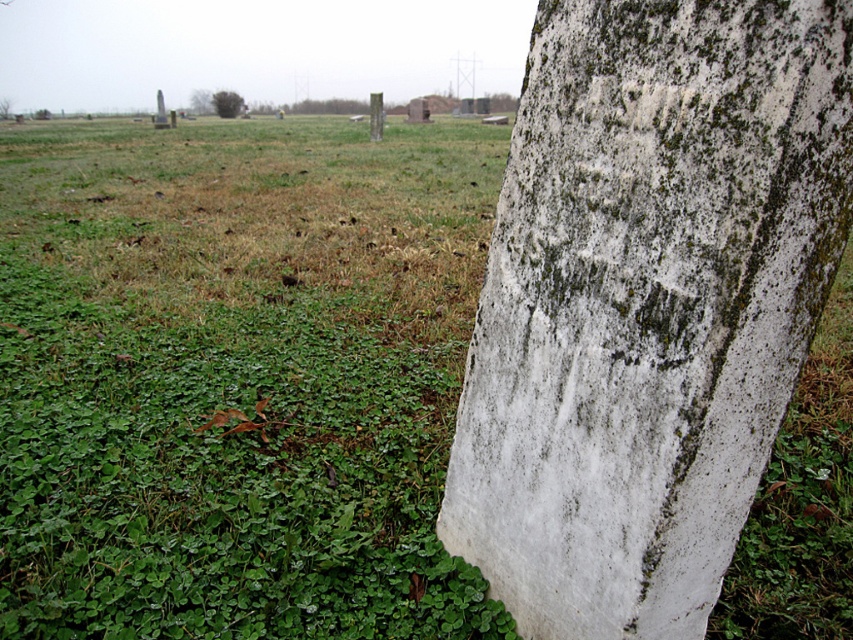
You are an archaeologist examining the field. You need to determine which object is wider between the white weathered stone at center and the green mossy tree at upper left. Based on the scene, which one is wider?

The white weathered stone at center has a lesser width compared to green mossy tree at upper left, so the green mossy tree at upper left is wider.

You are standing in the field and want to place a new marker exactly at the location of the white weathered stone at center. What are the coordinates where you should place it?

The coordinates for the white weathered stone at center are (647, 301).

You are a hiker lost in a field with several gravestones. You see a white weathered stone at center and a green mossy tree at upper left. Which object is positioned to the right of the other?

The white weathered stone at center is to the right of the green mossy tree at upper left.